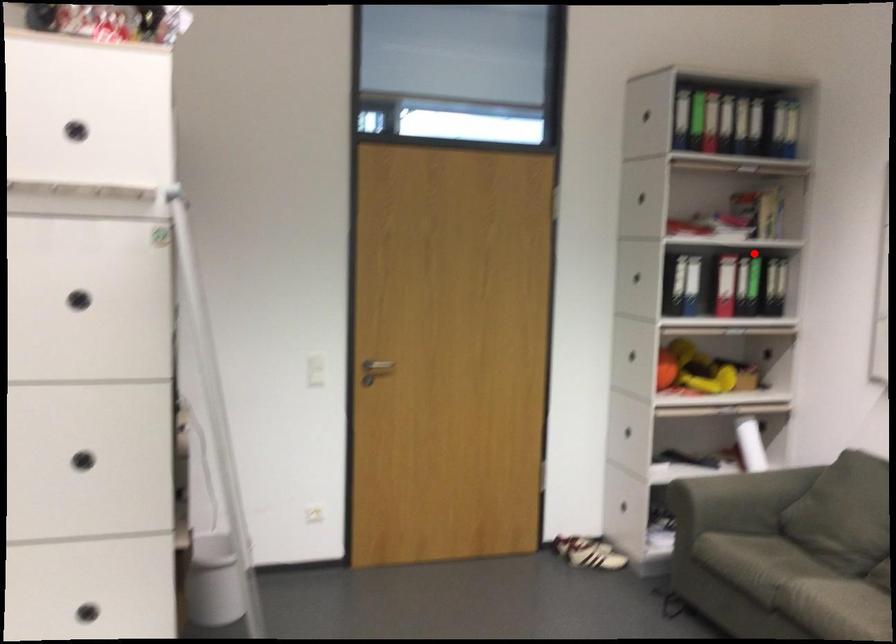
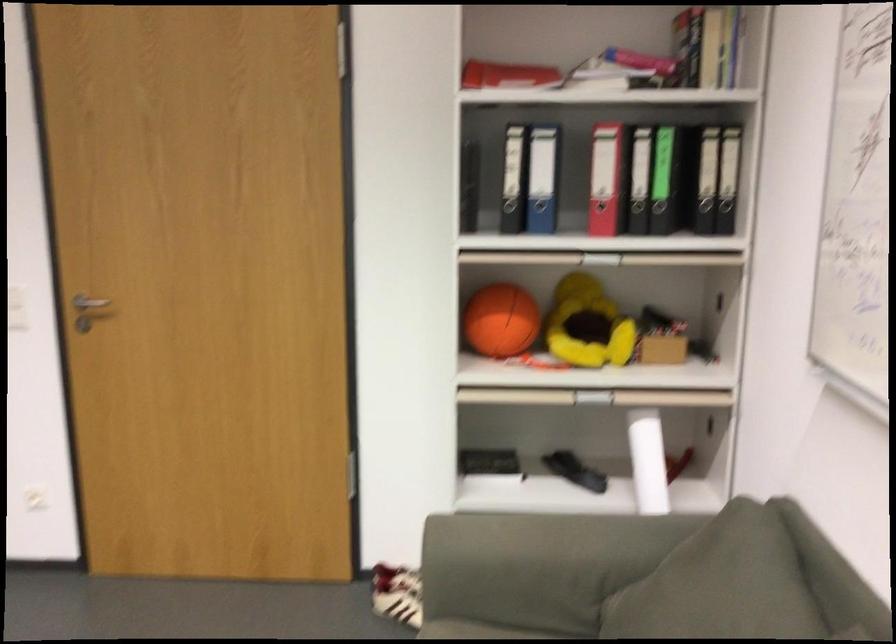
In the second image, find the point that corresponds to the highlighted location in the first image.

(662, 140)